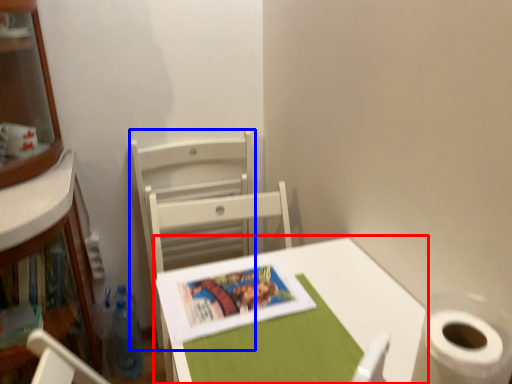
Question: Which point is further to the camera, table (highlighted by a red box) or chair (highlighted by a blue box)?

Choices:
 (A) table
 (B) chair

Answer: (B)